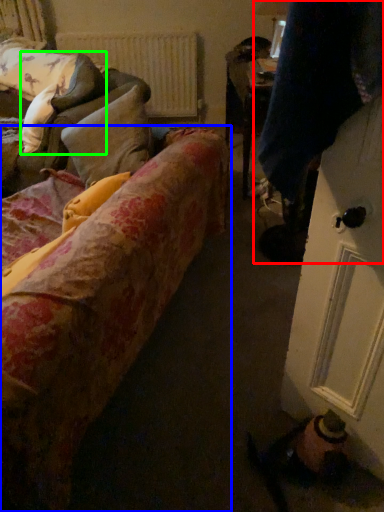
Question: Estimate the real-world distances between objects in this image. Which object is closer to couple (highlighted by a red box), studio couch (highlighted by a blue box) or pillow (highlighted by a green box)?

Choices:
 (A) studio couch
 (B) pillow

Answer: (A)